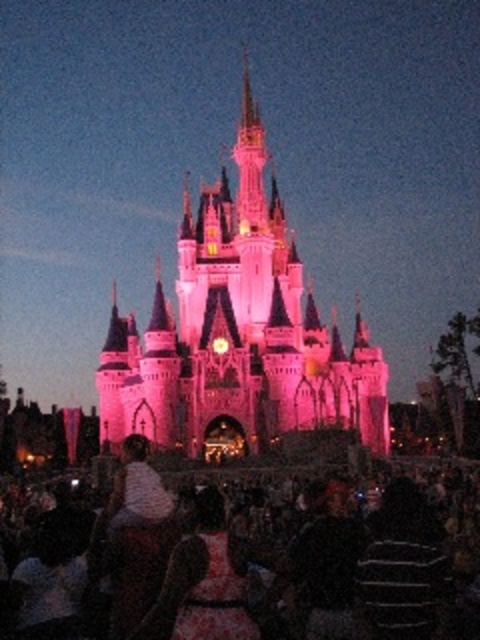
Looking at this image, you are standing in front of the castle and notice two points marked on the image. The first point is at coordinates point (273,340) and the second is at point (321,476). Which point is closer to you?

Point (273,340) is closer to the viewer than point (321,476).

In the scene shown: You are standing in front of the pink stone castle at center. If you want to take a photo of the castle from the exact center point of its structure, where should you aim your camera?

The exact center point of the pink stone castle at center is located at coordinates 0.522 on the x axis and 0.496 on the y axis, so aim your camera there.

You are standing at the point marked as point (238,333) in the image. What structure are you facing?

The point (238,333) corresponds to the pink stone castle at center, so you are facing the pink stone castle at center.